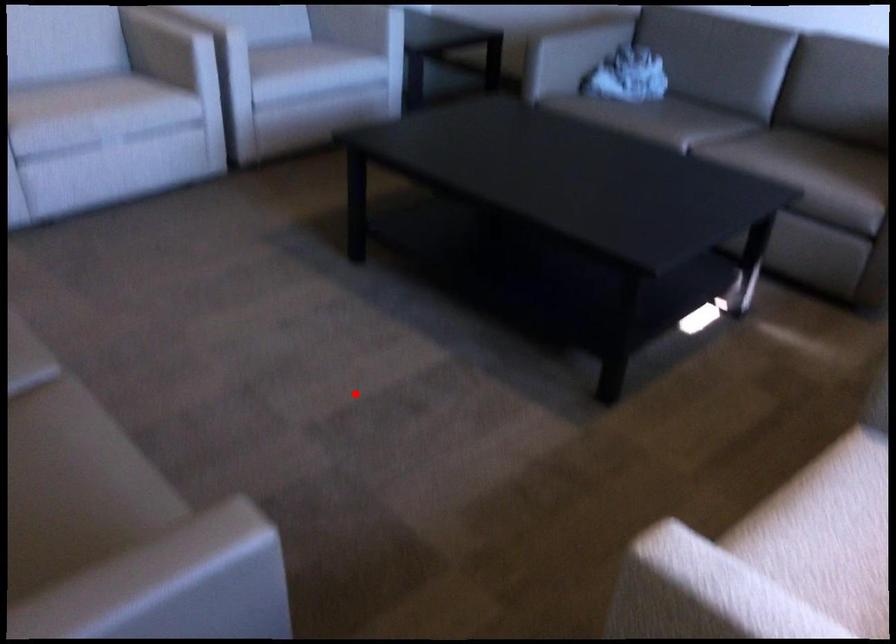
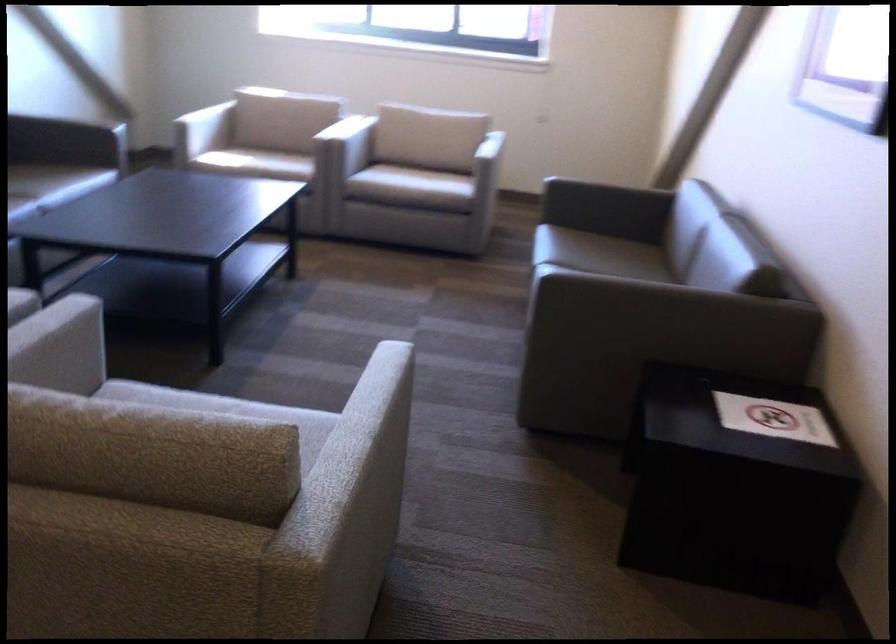
In the second image, find the point that corresponds to the highlighted location in the first image.

(352, 330)